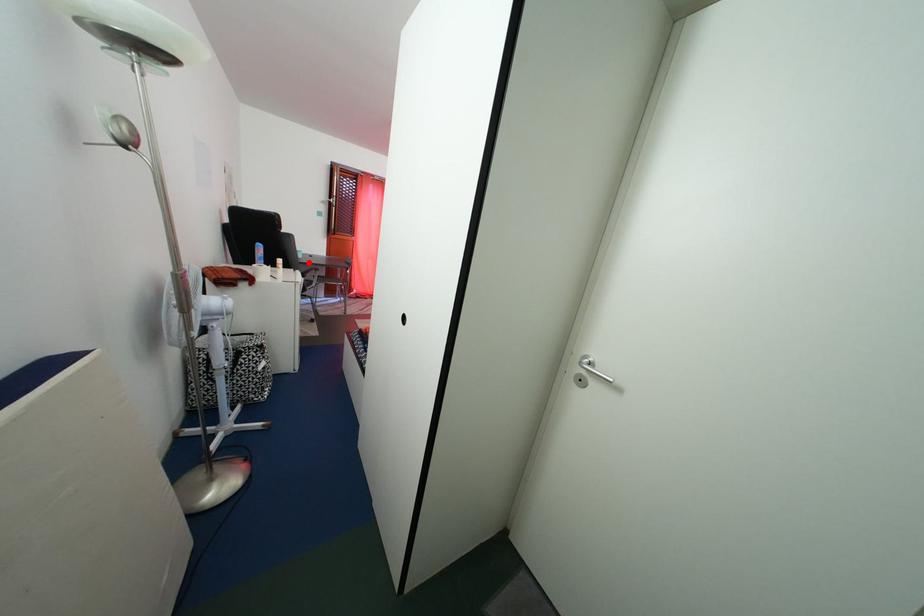
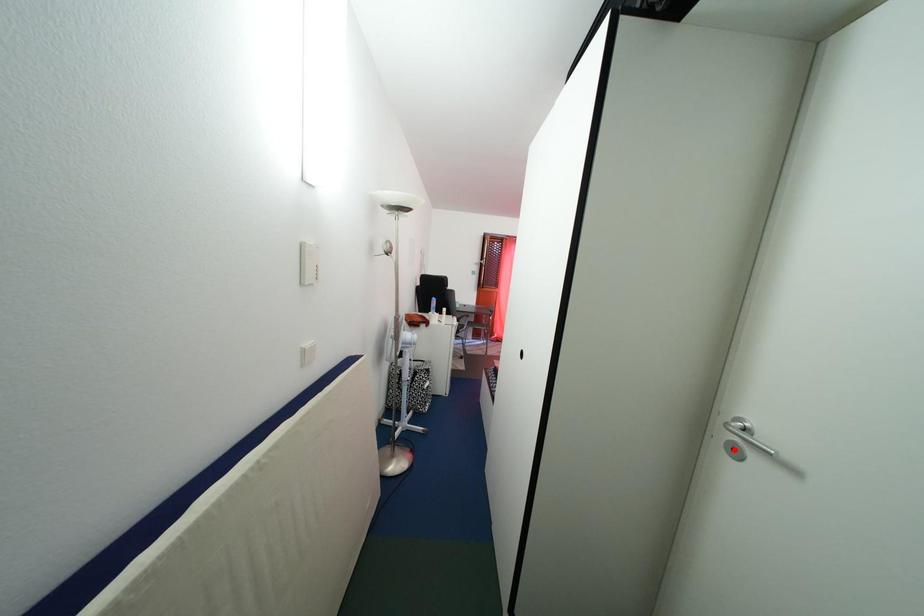
I am providing you with two images of the same scene from different viewpoints. A red point is marked on the first image and another point is marked on the second image. Are the points marked in image1 and image2 representing the same 3D position?

No